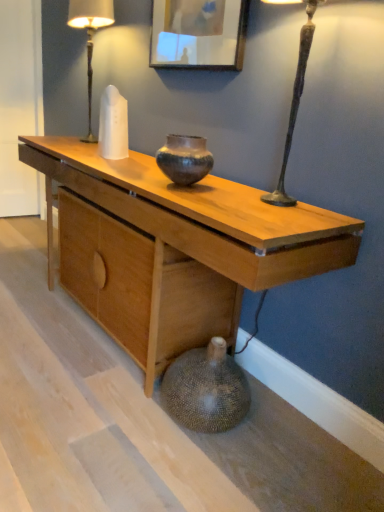
Question: Should I look upward or downward to see white glass table lamp at upper left?

Choices:
 (A) up
 (B) down

Answer: (A)

Question: From a real-world perspective, is white glass table lamp at upper left on wooden picture frame at upper center?

Choices:
 (A) yes
 (B) no

Answer: (B)

Question: Is white glass table lamp at upper left facing towards wooden picture frame at upper center?

Choices:
 (A) yes
 (B) no

Answer: (B)

Question: Is white glass table lamp at upper left to the right of wooden picture frame at upper center from the viewer's perspective?

Choices:
 (A) yes
 (B) no

Answer: (B)

Question: Is white glass table lamp at upper left in contact with wooden picture frame at upper center?

Choices:
 (A) yes
 (B) no

Answer: (B)

Question: From a real-world perspective, is white glass table lamp at upper left beneath wooden picture frame at upper center?

Choices:
 (A) no
 (B) yes

Answer: (B)

Question: Considering the relative sizes of white glass table lamp at upper left and wooden picture frame at upper center in the image provided, is white glass table lamp at upper left thinner than wooden picture frame at upper center?

Choices:
 (A) no
 (B) yes

Answer: (A)

Question: Is white glass table lamp at upper left closer to camera compared to natural wood desk at center?

Choices:
 (A) yes
 (B) no

Answer: (B)

Question: Is white glass table lamp at upper left positioned behind natural wood desk at center?

Choices:
 (A) no
 (B) yes

Answer: (B)

Question: Considering the relative sizes of white glass table lamp at upper left and natural wood desk at center in the image provided, is white glass table lamp at upper left shorter than natural wood desk at center?

Choices:
 (A) yes
 (B) no

Answer: (A)

Question: Are white glass table lamp at upper left and natural wood desk at center beside each other?

Choices:
 (A) no
 (B) yes

Answer: (A)

Question: Is white glass table lamp at upper left to the left of natural wood desk at center from the viewer's perspective?

Choices:
 (A) no
 (B) yes

Answer: (B)

Question: From a real-world perspective, does white glass table lamp at upper left stand above natural wood desk at center?

Choices:
 (A) yes
 (B) no

Answer: (A)

Question: Does natural wood desk at center come in front of earthy brown ceramic vase at center?

Choices:
 (A) no
 (B) yes

Answer: (B)